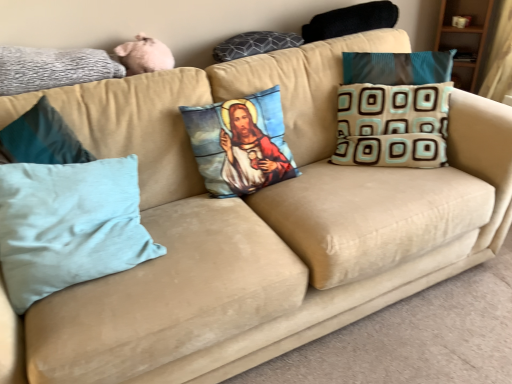
Question: Is printed fabric pillow with religious imagery at center, which is the third pillow in left-to-right order, not inside gray textured pillow at upper left, the first pillow in the left-to-right sequence?

Choices:
 (A) no
 (B) yes

Answer: (B)

Question: From a real-world perspective, does printed fabric pillow with religious imagery at center, which is the third pillow in left-to-right order, sit lower than gray textured pillow at upper left, the first pillow in the left-to-right sequence?

Choices:
 (A) yes
 (B) no

Answer: (A)

Question: Is printed fabric pillow with religious imagery at center, the fourth pillow in the right-to-left sequence, oriented away from gray textured pillow at upper left, which ranks as the 6th pillow in right-to-left order?

Choices:
 (A) yes
 (B) no

Answer: (B)

Question: Is printed fabric pillow with religious imagery at center, which is the third pillow in left-to-right order, thinner than gray textured pillow at upper left, which ranks as the 6th pillow in right-to-left order?

Choices:
 (A) no
 (B) yes

Answer: (A)

Question: Is printed fabric pillow with religious imagery at center, the fourth pillow in the right-to-left sequence, shorter than gray textured pillow at upper left, which ranks as the 6th pillow in right-to-left order?

Choices:
 (A) no
 (B) yes

Answer: (A)

Question: From a real-world perspective, does printed fabric pillow with religious imagery at center, which is the third pillow in left-to-right order, stand above gray textured pillow at upper left, the first pillow in the left-to-right sequence?

Choices:
 (A) yes
 (B) no

Answer: (B)

Question: From the image's perspective, is light blue fabric pillow at left, which is counted as the fifth pillow, starting from the right, located beneath black fuzzy pillow at upper right, which appears as the 5th pillow when viewed from the left?

Choices:
 (A) no
 (B) yes

Answer: (B)

Question: From a real-world perspective, is light blue fabric pillow at left, which ranks as the second pillow in left-to-right order, physically above black fuzzy pillow at upper right, marked as the second pillow in a right-to-left arrangement?

Choices:
 (A) no
 (B) yes

Answer: (A)

Question: Does light blue fabric pillow at left, which ranks as the second pillow in left-to-right order, have a larger size compared to black fuzzy pillow at upper right, which appears as the 5th pillow when viewed from the left?

Choices:
 (A) yes
 (B) no

Answer: (A)

Question: Can you see light blue fabric pillow at left, which ranks as the second pillow in left-to-right order, touching black fuzzy pillow at upper right, which appears as the 5th pillow when viewed from the left?

Choices:
 (A) no
 (B) yes

Answer: (A)

Question: Is light blue fabric pillow at left, which is counted as the fifth pillow, starting from the right, positioned before black fuzzy pillow at upper right, marked as the second pillow in a right-to-left arrangement?

Choices:
 (A) yes
 (B) no

Answer: (A)

Question: Does light blue fabric pillow at left, which is counted as the fifth pillow, starting from the right, appear on the right side of black fuzzy pillow at upper right, which appears as the 5th pillow when viewed from the left?

Choices:
 (A) yes
 (B) no

Answer: (B)

Question: From a real-world perspective, is black fuzzy pillow at upper right, which appears as the 5th pillow when viewed from the left, located higher than dark gray textured pillow at upper center, which ranks as the fourth pillow in left-to-right order?

Choices:
 (A) yes
 (B) no

Answer: (A)